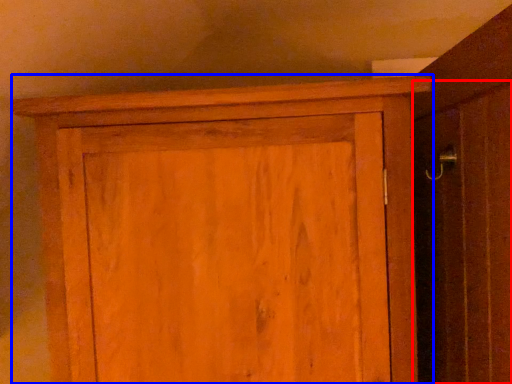
Question: Which object appears closest to the camera in this image, screen door (highlighted by a red box) or cupboard (highlighted by a blue box)?

Choices:
 (A) screen door
 (B) cupboard

Answer: (A)